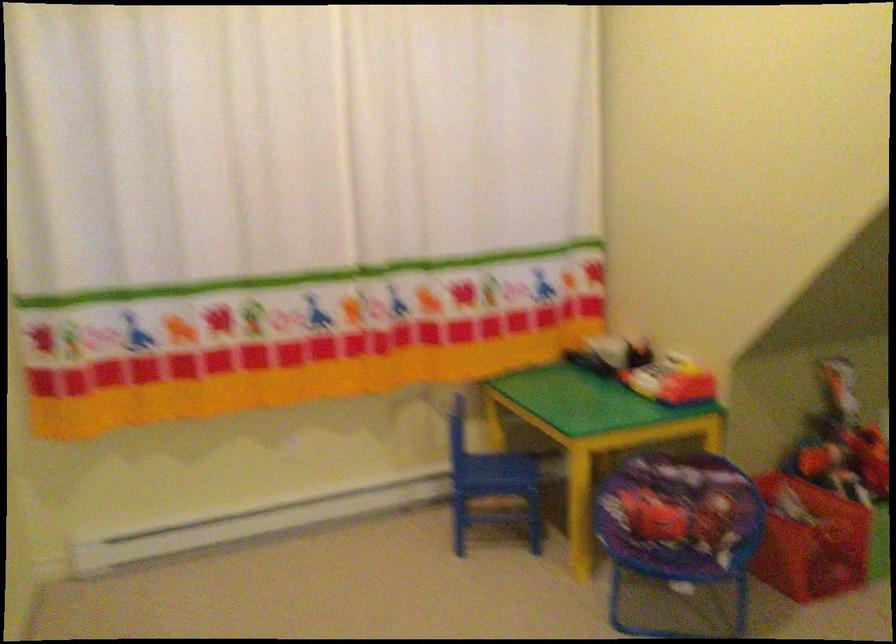
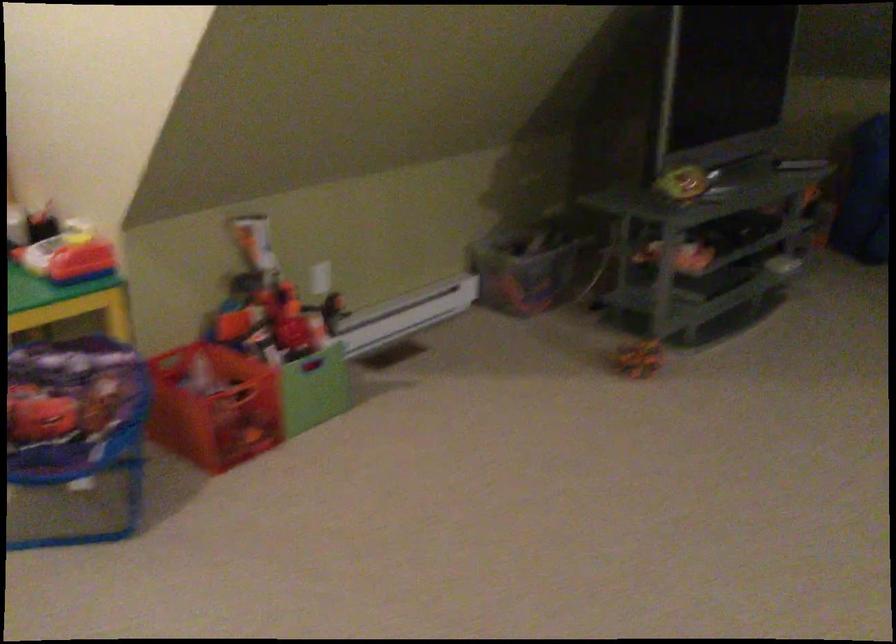
Question: What movement of the cameraman would produce the second image?

Choices:
 (A) Left
 (B) Right
 (C) Forward
 (D) Backward

Answer: (B)